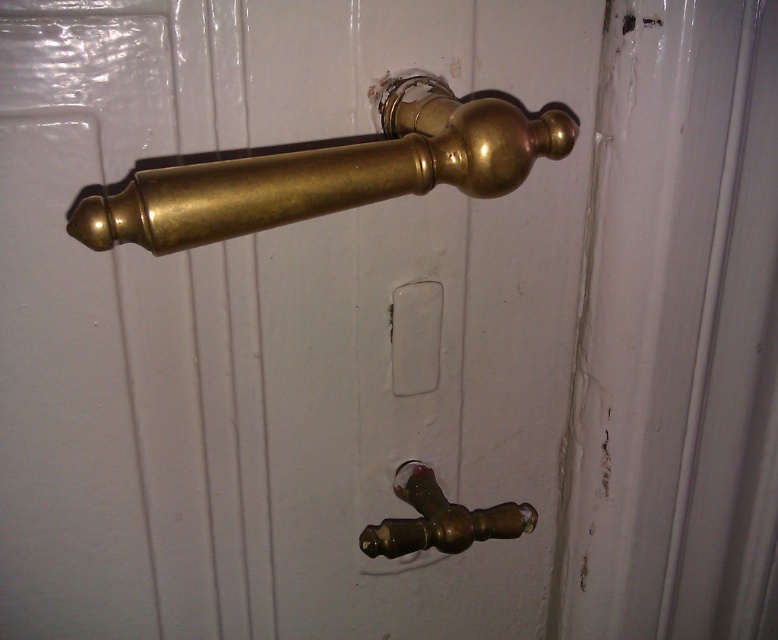
Can you confirm if brass/polished handle at center is taller than brass/polished metal faucet at lower center?

Correct, brass/polished handle at center is much taller as brass/polished metal faucet at lower center.

Is brass/polished handle at center thinner than brass/polished metal faucet at lower center?

No, brass/polished handle at center is not thinner than brass/polished metal faucet at lower center.

Who is more distant from viewer, (x=489, y=112) or (x=389, y=529)?

The point (x=389, y=529) is behind.

At what (x,y) coordinates should I click in order to perform the action: click on brass/polished handle at center. Please return your answer as a coordinate pair (x, y). This screenshot has height=640, width=778. Looking at the image, I should click on (331, 172).